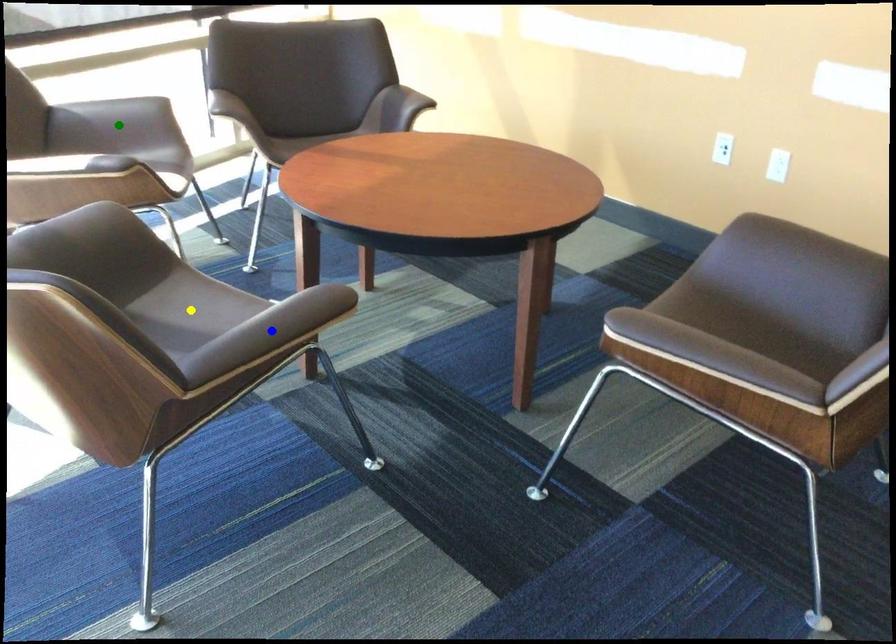
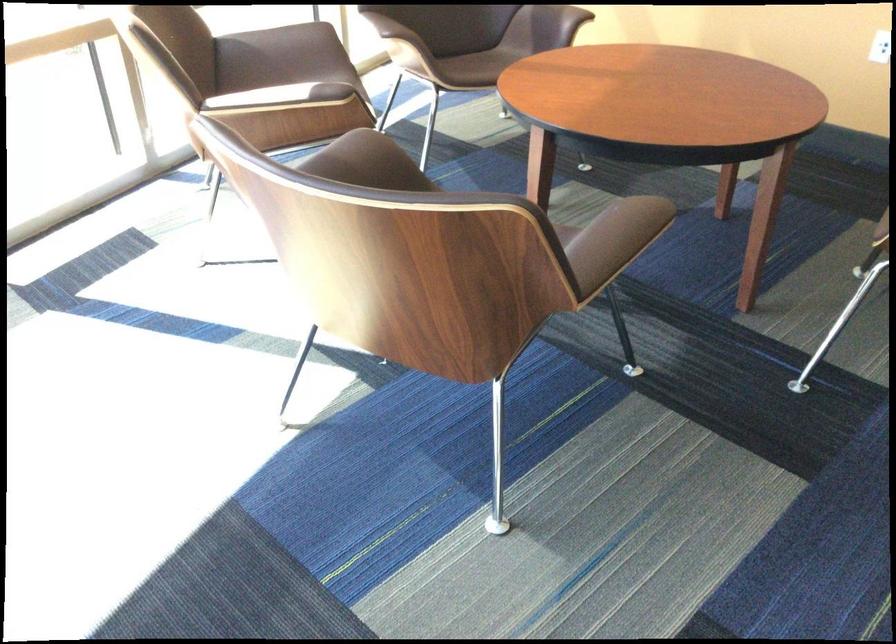
I am providing you with two images of the same scene from different viewpoints. Three points are marked in image1. Which point corresponds to a part or object that is occluded in image2?In image1, three points are marked. Which of them correspond to a part or object that is occluded in image2?Among the three points shown in image1, which one corresponds to a part or object that is no longer visible due to occlusion in image2?

Invisible in image2: yellow point.